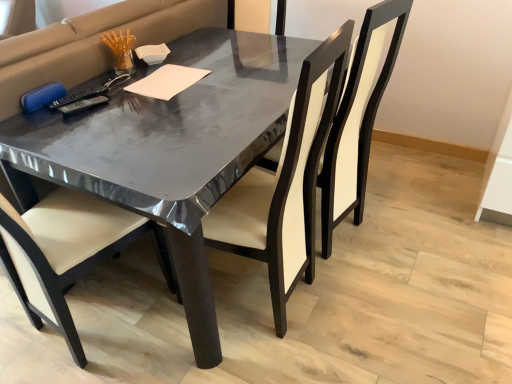
The width and height of the screenshot is (512, 384). In order to click on vacant space to the right of matte black chair at center, the second chair positioned from the right in this screenshot , I will do pos(374,311).